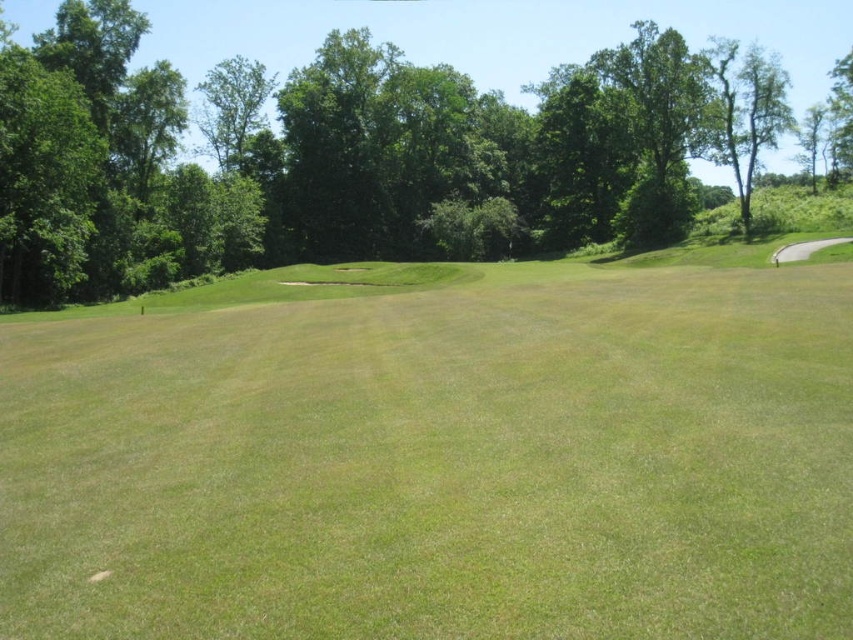
Question: Which point is closer to the camera taking this photo?

Choices:
 (A) (590, 531)
 (B) (288, 76)

Answer: (A)

Question: Where is green grassy field at center located in relation to green leafy tree at center in the image?

Choices:
 (A) right
 (B) left

Answer: (B)

Question: Is green grassy field at center smaller than green leafy tree at center?

Choices:
 (A) yes
 (B) no

Answer: (A)

Question: Can you confirm if green grassy field at center is positioned to the right of green leafy tree at center?

Choices:
 (A) yes
 (B) no

Answer: (B)